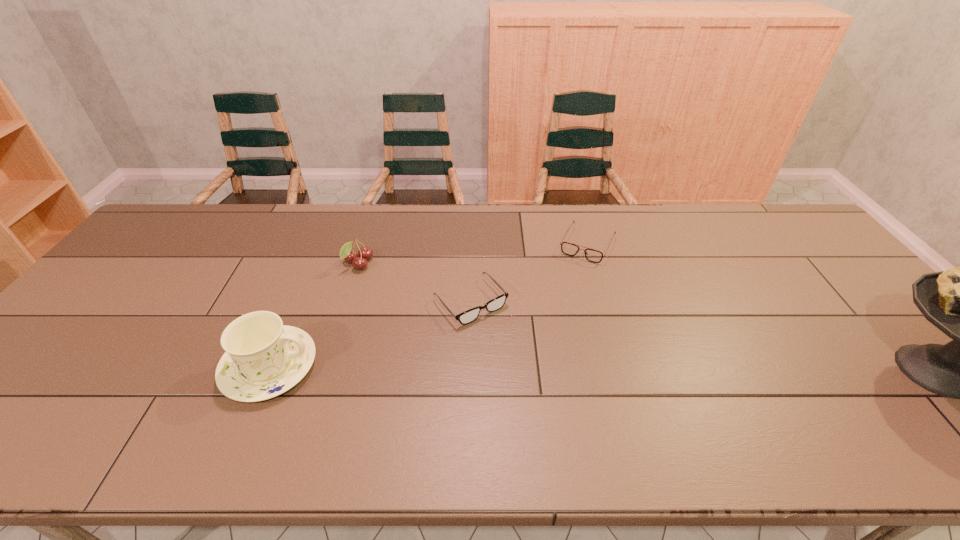
The image size is (960, 540). Find the location of `free space that is in between the third tallest object and the fourth shortest object`. free space that is in between the third tallest object and the fourth shortest object is located at coordinates (314, 315).

The width and height of the screenshot is (960, 540). What are the coordinates of `vacant point located between the third shortest object and the sunglasses` in the screenshot? It's located at (473, 254).

I want to click on unoccupied area between the fourth shortest object and the spectacles, so click(371, 334).

What are the coordinates of `free space between the fourth object from left to right and the second tallest object` in the screenshot? It's located at (428, 306).

At what (x,y) coordinates should I click in order to perform the action: click on vacant area that lies between the third object from right to left and the second object from right to left. Please return your answer as a coordinate pair (x, y). Looking at the image, I should click on (529, 273).

Where is `vacant area that lies between the cherry and the third object from left to right`? vacant area that lies between the cherry and the third object from left to right is located at coordinates (415, 282).

The width and height of the screenshot is (960, 540). Identify the location of vacant area between the chinaware and the third tallest object. (314, 315).

Identify the location of unoccupied area between the second object from right to left and the third object from right to left. (529, 273).

Where is `the second closest object to the second object from right to left`? The height and width of the screenshot is (540, 960). the second closest object to the second object from right to left is located at coordinates (959, 301).

I want to click on the second closest object relative to the spectacles, so click(365, 253).